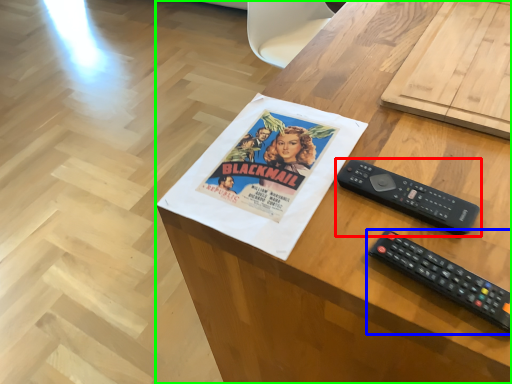
Question: Which object is positioned farthest from remote control (highlighted by a red box)? Select from remote control (highlighted by a blue box) and desk (highlighted by a green box).

Choices:
 (A) remote control
 (B) desk

Answer: (B)